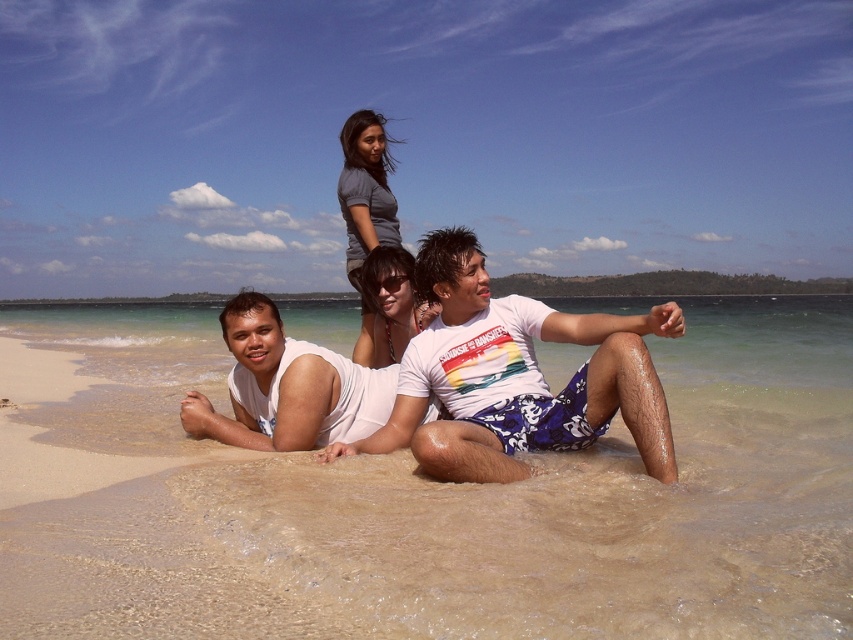
Question: Which is nearer to the gray matte shirt at upper center?

Choices:
 (A) matte white sunglasses at center
 (B) sandy beach at lower center

Answer: (A)

Question: Estimate the real-world distances between objects in this image. Which object is closer to the white printed t-shirt at center?

Choices:
 (A) sandy beach at lower center
 (B) matte white sunglasses at center
 (C) gray matte shirt at upper center

Answer: (B)

Question: Is white printed t-shirt at center further to the viewer compared to white matte t-shirt at center?

Choices:
 (A) yes
 (B) no

Answer: (B)

Question: Does white matte t-shirt at center have a greater width compared to matte white sunglasses at center?

Choices:
 (A) yes
 (B) no

Answer: (A)

Question: Which point appears farthest from the camera in this image?

Choices:
 (A) (355, 129)
 (B) (387, 374)
 (C) (396, 300)
 (D) (668, 321)

Answer: (A)

Question: Can you confirm if sandy beach at lower center is bigger than matte white sunglasses at center?

Choices:
 (A) no
 (B) yes

Answer: (A)